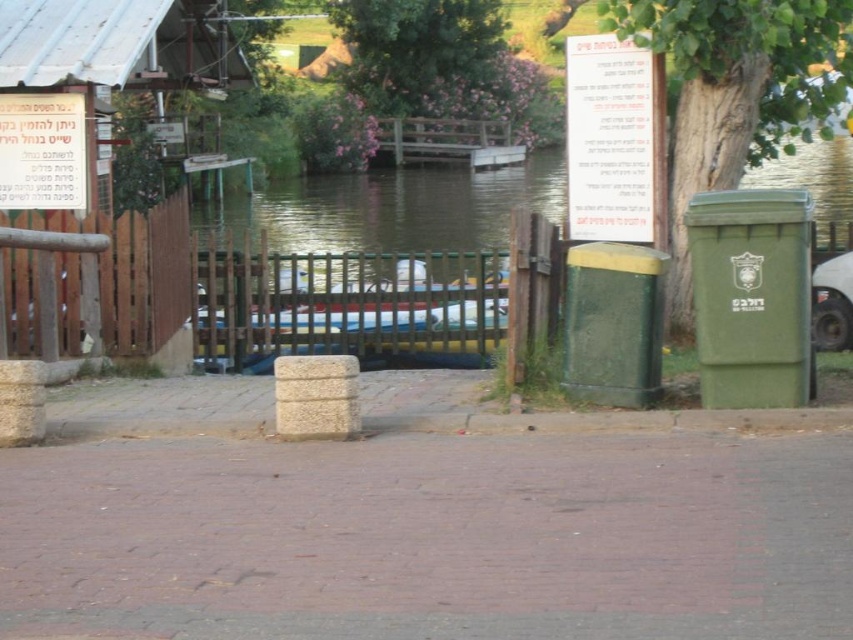
Question: Is green wooden fence at center behind brown wooden fence at left?

Choices:
 (A) yes
 (B) no

Answer: (A)

Question: Considering the real-world distances, which object is closest to the wooden sign at left?

Choices:
 (A) brown wooden fence at left
 (B) green textured bin at center
 (C) white paper sign at upper left
 (D) green wooden fence at center

Answer: (C)

Question: Which of the following is the farthest from the observer?

Choices:
 (A) white paper sign at upper left
 (B) green wooden fence at center

Answer: (B)

Question: Does brick pavement at center appear under wooden sign at left?

Choices:
 (A) no
 (B) yes

Answer: (B)

Question: Which is farther from the brick pavement at center?

Choices:
 (A) brown wooden fence at left
 (B) white paper sign at upper center
 (C) white paper sign at upper left

Answer: (B)

Question: Can you confirm if green wooden fence at center is smaller than white paper sign at upper left?

Choices:
 (A) no
 (B) yes

Answer: (A)